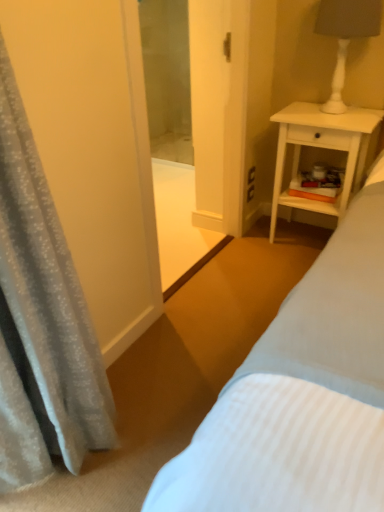
The width and height of the screenshot is (384, 512). I want to click on free point below white matte lamp at upper right (from a real-world perspective), so click(337, 114).